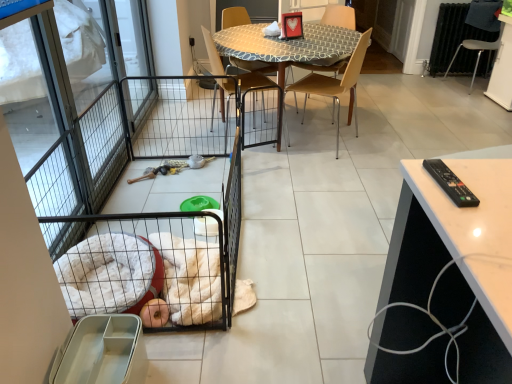
Where is `free spot to the right of black wire pet cage at left`? Image resolution: width=512 pixels, height=384 pixels. free spot to the right of black wire pet cage at left is located at coordinates (338, 203).